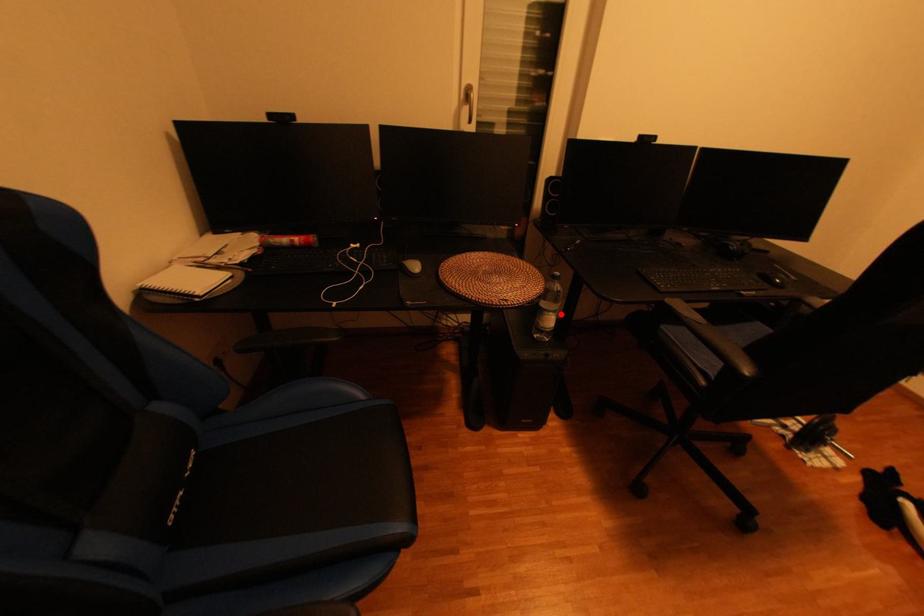
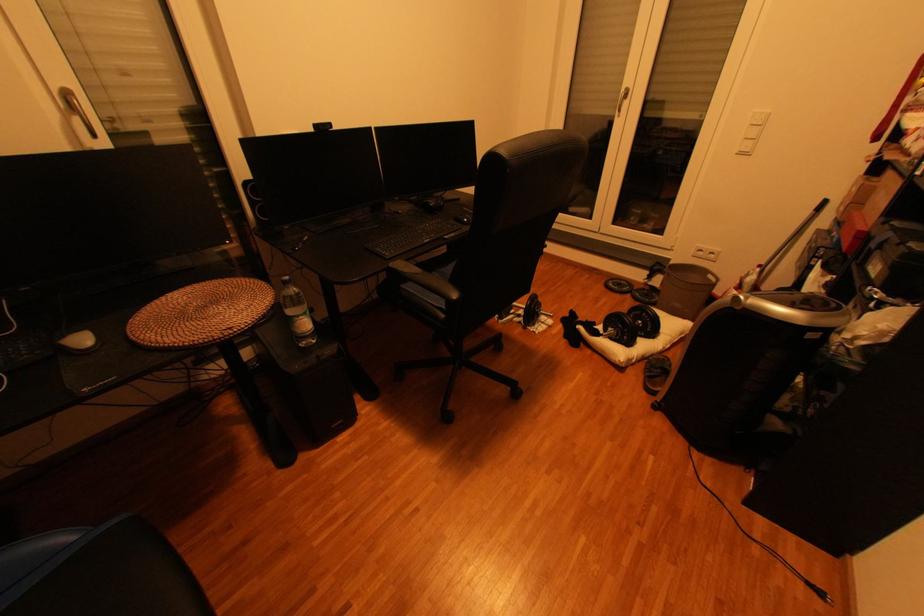
Question: I am providing you with two images of the same scene from different viewpoints. In image1, a red point is highlighted. Considering the same 3D point in image2, which of the following is correct?

Choices:
 (A) It is closer
 (B) It is farther

Answer: (A)